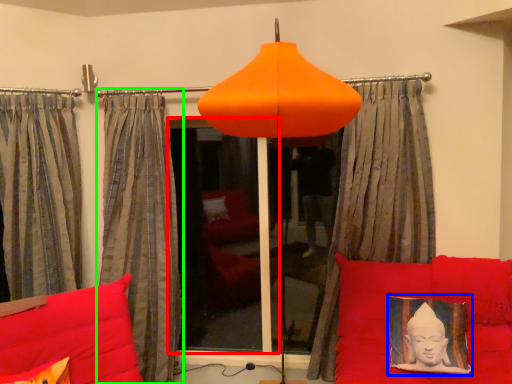
Question: Which is nearer to the window screen (highlighted by a red box)? picture frame (highlighted by a blue box) or curtain (highlighted by a green box).

Choices:
 (A) picture frame
 (B) curtain

Answer: (B)